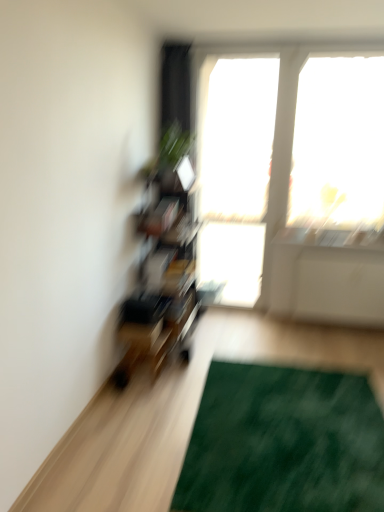
Question: From the image's perspective, is transparent glass window at upper right, the 2th window screen in the left-to-right sequence, on top of green textured mat at lower right?

Choices:
 (A) yes
 (B) no

Answer: (A)

Question: Considering the relative sizes of transparent glass window at upper right, which appears as the first window screen when viewed from the right, and green textured mat at lower right in the image provided, is transparent glass window at upper right, which appears as the first window screen when viewed from the right, smaller than green textured mat at lower right?

Choices:
 (A) yes
 (B) no

Answer: (B)

Question: Is transparent glass window at upper right, which appears as the first window screen when viewed from the right, oriented towards green textured mat at lower right?

Choices:
 (A) yes
 (B) no

Answer: (A)

Question: Would you consider transparent glass window at upper right, which appears as the first window screen when viewed from the right, to be distant from green textured mat at lower right?

Choices:
 (A) no
 (B) yes

Answer: (B)

Question: From the image's perspective, is transparent glass window at upper right, which appears as the first window screen when viewed from the right, beneath green textured mat at lower right?

Choices:
 (A) no
 (B) yes

Answer: (A)

Question: Is green textured mat at lower right bigger or smaller than green leafy plant at upper center?

Choices:
 (A) big
 (B) small

Answer: (A)

Question: From a real-world perspective, is green textured mat at lower right physically located above or below green leafy plant at upper center?

Choices:
 (A) below
 (B) above

Answer: (A)

Question: In the image, is green textured mat at lower right on the left side or the right side of green leafy plant at upper center?

Choices:
 (A) right
 (B) left

Answer: (A)

Question: Looking at their shapes, would you say green textured mat at lower right is wider or thinner than green leafy plant at upper center?

Choices:
 (A) wide
 (B) thin

Answer: (A)

Question: In terms of width, does transparent glass window at upper right, which appears as the first window screen when viewed from the right, look wider or thinner when compared to green leafy plant at upper center?

Choices:
 (A) thin
 (B) wide

Answer: (A)

Question: Considering the positions of point (306, 202) and point (160, 143), is point (306, 202) closer or farther from the camera than point (160, 143)?

Choices:
 (A) closer
 (B) farther

Answer: (B)

Question: From a real-world perspective, is transparent glass window at upper right, the 2th window screen in the left-to-right sequence, above or below green leafy plant at upper center?

Choices:
 (A) above
 (B) below

Answer: (A)

Question: Is transparent glass window at upper right, which appears as the first window screen when viewed from the right, inside or outside of green leafy plant at upper center?

Choices:
 (A) outside
 (B) inside

Answer: (A)

Question: From the image's perspective, is green leafy plant at upper center above or below green textured mat at lower right?

Choices:
 (A) below
 (B) above

Answer: (B)

Question: Is green leafy plant at upper center taller or shorter than green textured mat at lower right?

Choices:
 (A) short
 (B) tall

Answer: (B)